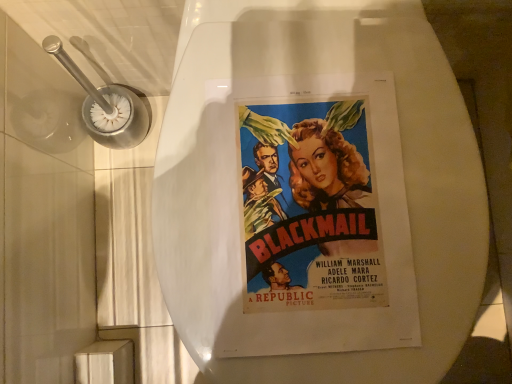
You are a GUI agent. You are given a task and a screenshot of the screen. Output one action in this format:
    pyautogui.click(x=<x>, y=<y>)
    Task: Click on the brushed metal toilet brush holder at upper left
    The image size is (512, 384).
    Given the screenshot: What is the action you would take?
    pyautogui.click(x=106, y=106)

What do you see at coordinates (106, 106) in the screenshot?
I see `brushed metal toilet brush holder at upper left` at bounding box center [106, 106].

You are a GUI agent. You are given a task and a screenshot of the screen. Output one action in this format:
    pyautogui.click(x=<x>, y=<y>)
    Task: Click on the brushed metal toilet brush holder at upper left
    This screenshot has width=512, height=384.
    Given the screenshot: What is the action you would take?
    pyautogui.click(x=106, y=106)